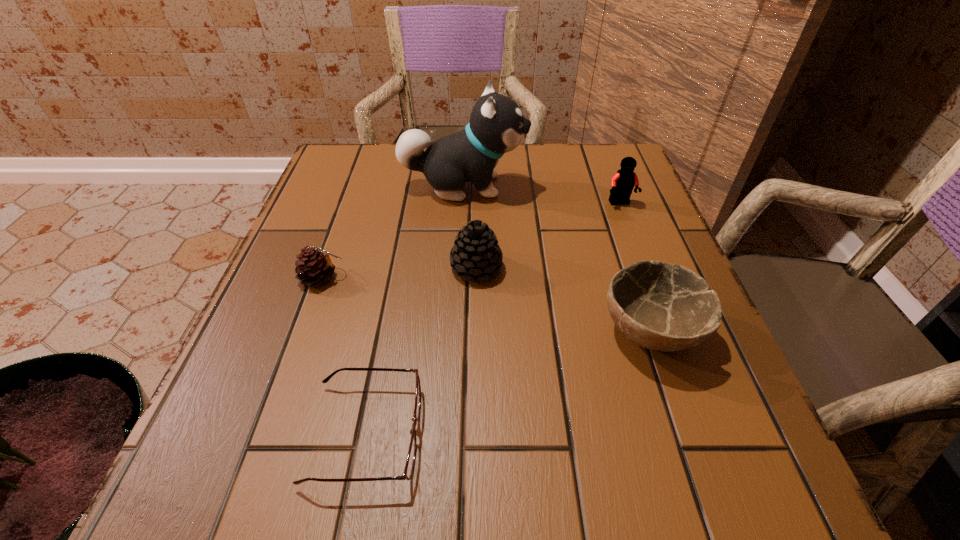
This screenshot has width=960, height=540. What are the coordinates of `empty space between the right pinecone and the spectacles` in the screenshot? It's located at (420, 350).

Image resolution: width=960 pixels, height=540 pixels. I want to click on empty location between the nearest object and the right pinecone, so [420, 350].

Where is `vacant point located between the puppy and the fourth tallest object`? vacant point located between the puppy and the fourth tallest object is located at coordinates (557, 259).

Where is `object that stands as the third closest to the tallest object`? object that stands as the third closest to the tallest object is located at coordinates (314, 267).

Locate an element on the screen. object that stands as the second closest to the shorter pinecone is located at coordinates (476, 253).

The image size is (960, 540). I want to click on vacant position in the image that satisfies the following two spatial constraints: 1. at the narrow end of the right pinecone; 2. on the back side of the third shortest object, so click(476, 332).

Where is `vacant point that satisfies the following two spatial constraints: 1. at the face of the tallest object; 2. on the back side of the fourth tallest object`? This screenshot has height=540, width=960. vacant point that satisfies the following two spatial constraints: 1. at the face of the tallest object; 2. on the back side of the fourth tallest object is located at coordinates (456, 332).